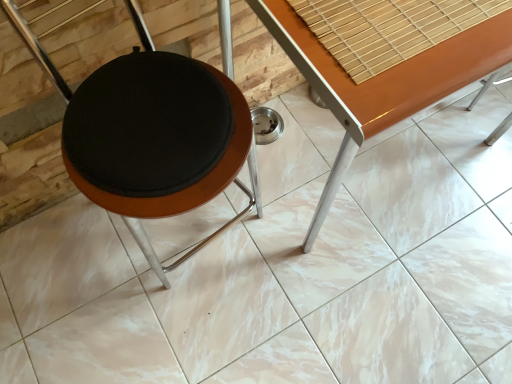
What are the coordinates of `vacant space positioned to the left of matte black stool at center` in the screenshot? It's located at (68, 266).